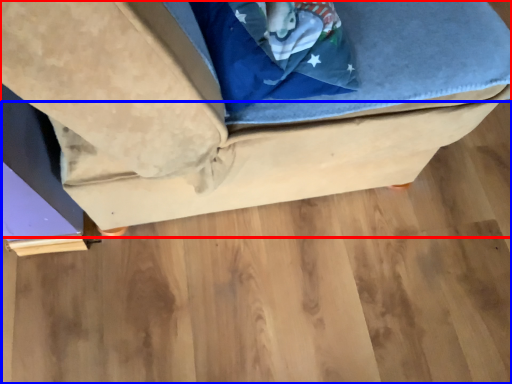
Question: Which object appears closest to the camera in this image, furniture (highlighted by a red box) or wood (highlighted by a blue box)?

Choices:
 (A) furniture
 (B) wood

Answer: (A)